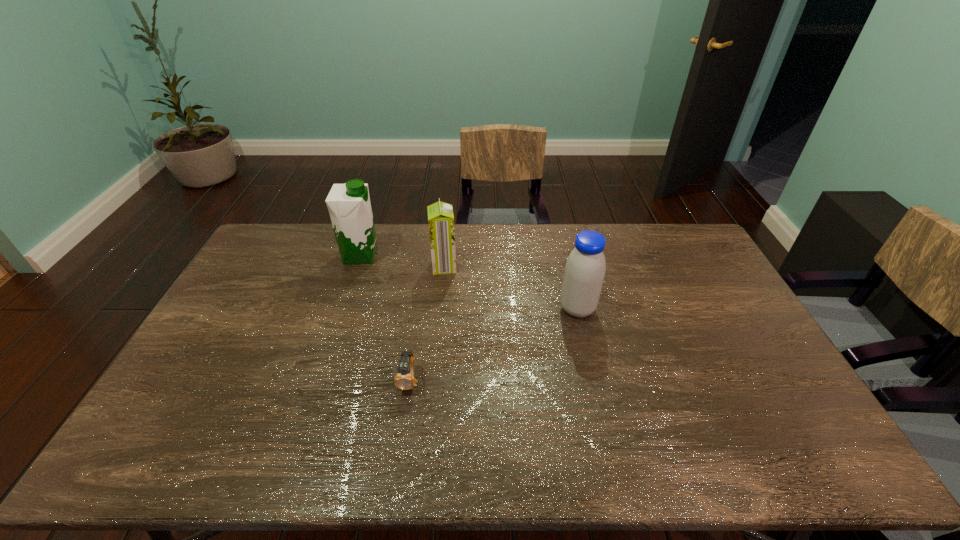
In order to click on free spot between the leftmost soya milk and the second nearest object in this screenshot , I will do `click(468, 282)`.

This screenshot has height=540, width=960. I want to click on vacant area that lies between the leftmost soya milk and the second soya milk from right to left, so click(x=402, y=261).

Identify the location of free space between the nearest soya milk and the leftmost object. (468, 282).

Identify the location of vacant area that lies between the leftmost soya milk and the second soya milk from right to left. (402, 261).

This screenshot has height=540, width=960. Identify the location of vacant space that is in between the second soya milk from left to right and the third farthest object. (511, 288).

Select which object is the closest to the second soya milk from left to right. Please provide its 2D coordinates. Your answer should be formatted as a tuple, i.e. [(x, y)], where the tuple contains the x and y coordinates of a point satisfying the conditions above.

[(349, 206)]

Select which object is the closest to the leftmost soya milk. Please provide its 2D coordinates. Your answer should be formatted as a tuple, i.e. [(x, y)], where the tuple contains the x and y coordinates of a point satisfying the conditions above.

[(440, 215)]

Locate which soya milk ranks second in proximity to the second soya milk from right to left. Please provide its 2D coordinates. Your answer should be formatted as a tuple, i.e. [(x, y)], where the tuple contains the x and y coordinates of a point satisfying the conditions above.

[(585, 268)]

At what (x,y) coordinates should I click in order to perform the action: click on the second closest soya milk to the watch. Please return your answer as a coordinate pair (x, y). The width and height of the screenshot is (960, 540). Looking at the image, I should click on (585, 268).

In order to click on vacant position in the image that satisfies the following two spatial constraints: 1. on the front-facing side of the leftmost object; 2. on the right side of the second soya milk from right to left in this screenshot , I will do `click(357, 266)`.